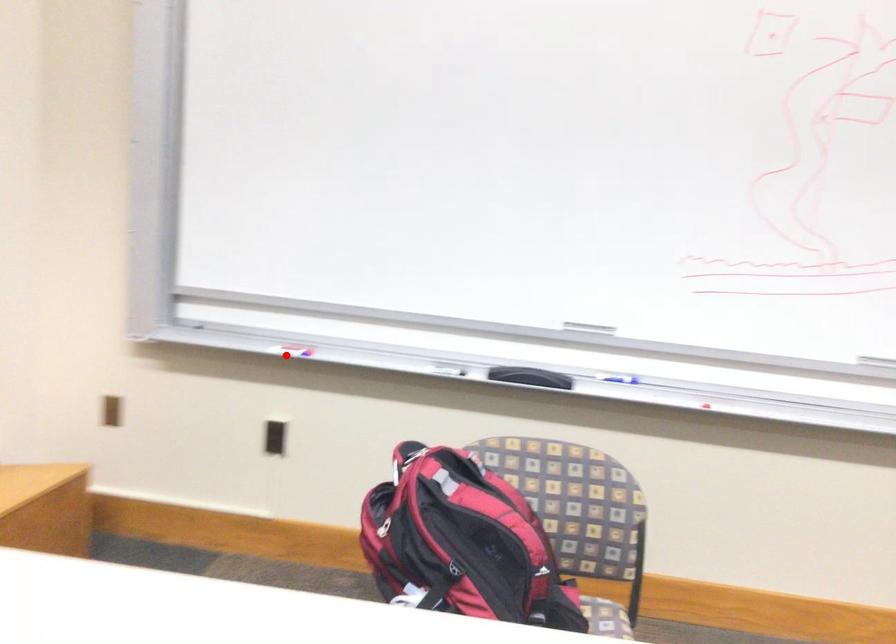
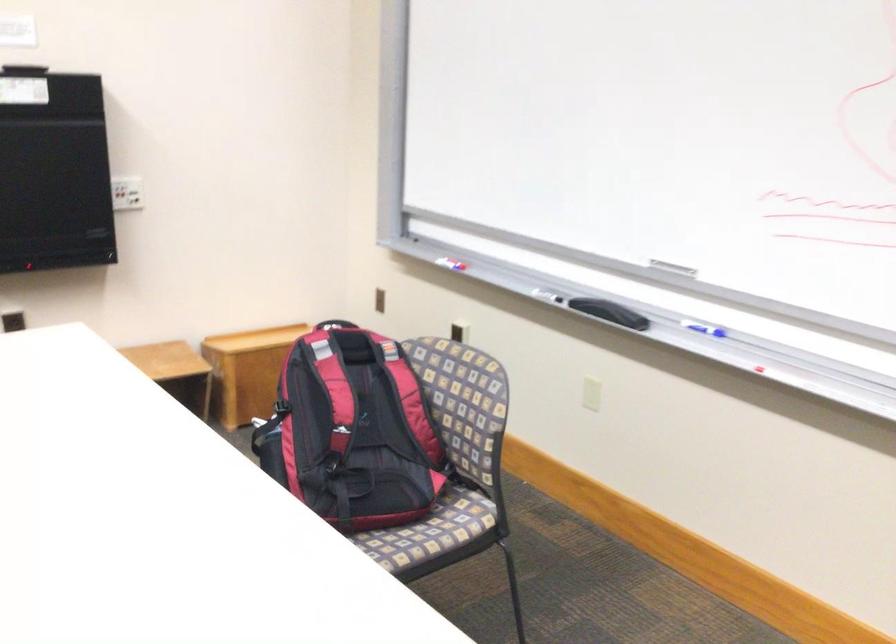
Question: A red point is marked in image1. In image2, is the corresponding 3D point closer to the camera or farther? Reply with the corresponding letter.

Choices:
 (A) The corresponding 3D point is closer.
 (B) The corresponding 3D point is farther.

Answer: (B)